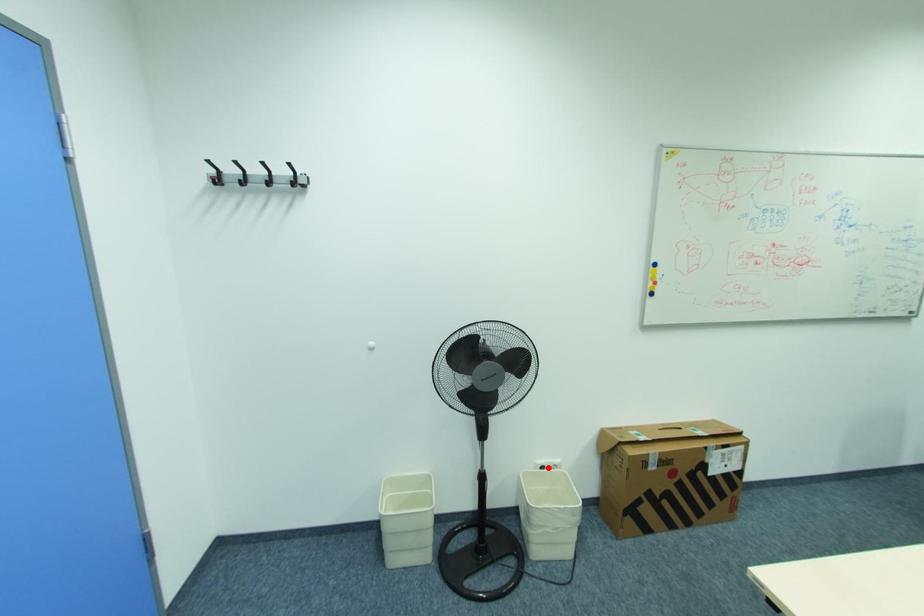
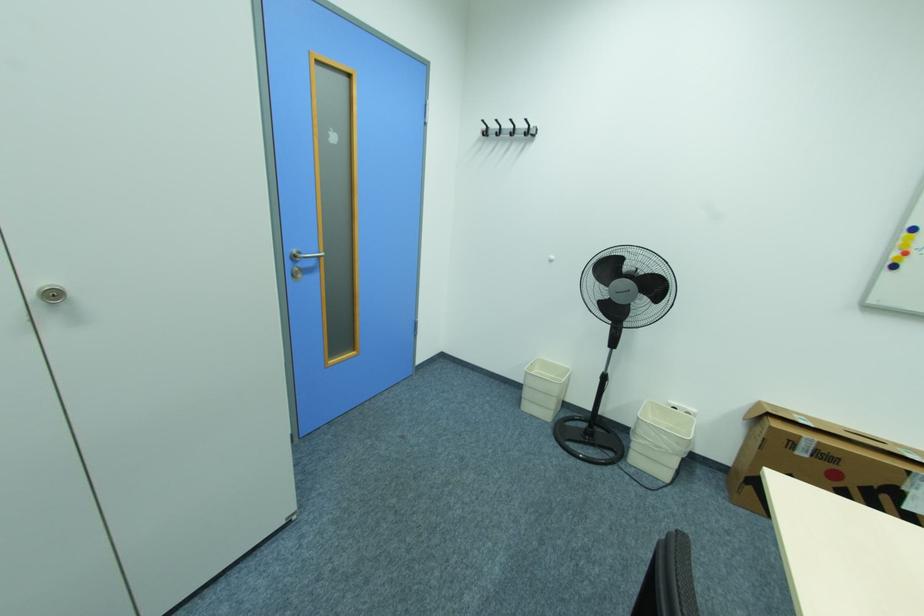
In the second image, find the point that corresponds to the highlighted location in the first image.

(679, 408)